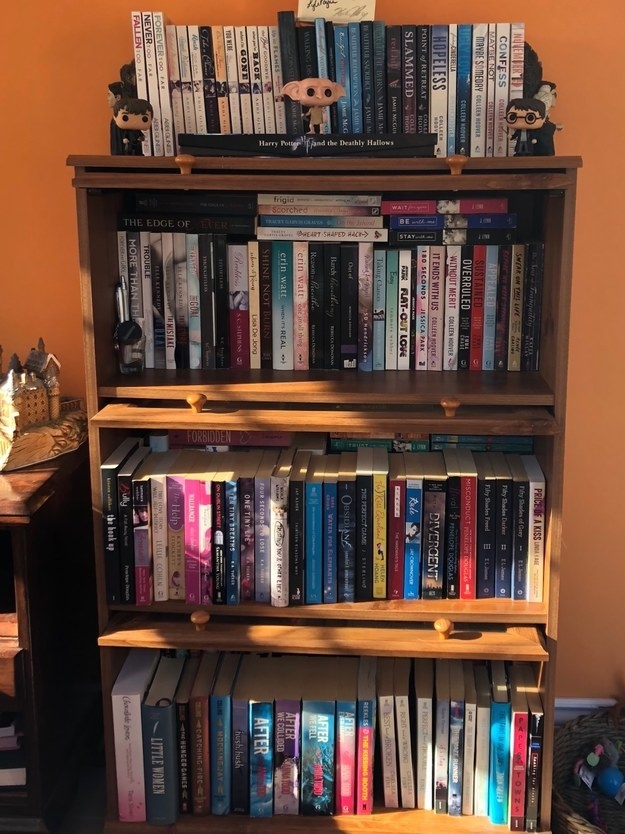
Find the location of a particular element. This screenshot has width=625, height=834. books on left is located at coordinates (18, 776), (18, 747), (12, 734).